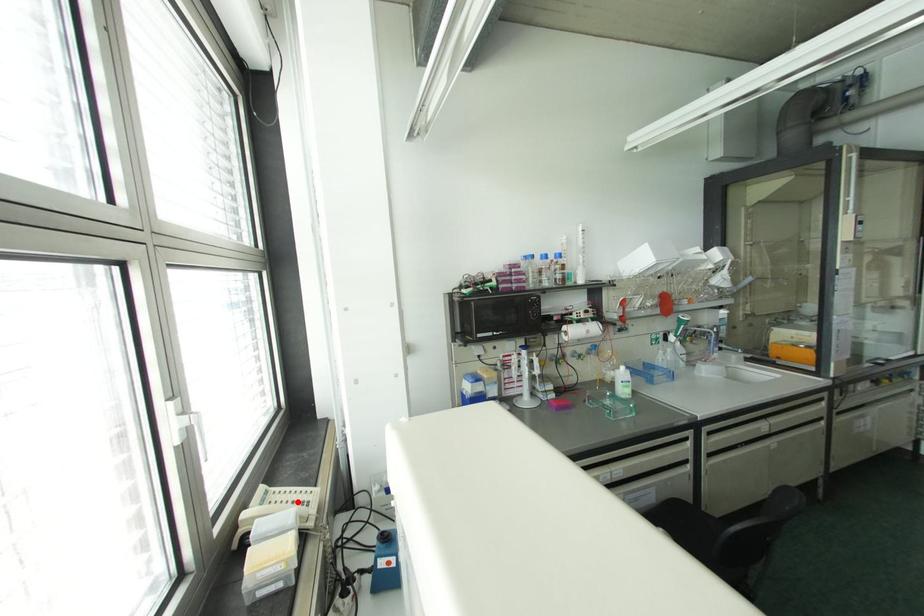
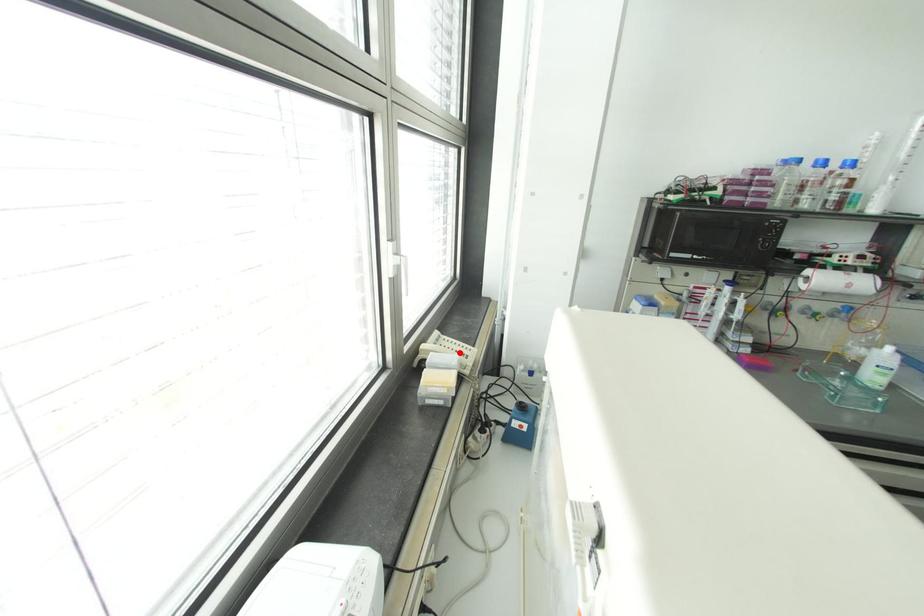
I am providing you with two images of the same scene from different viewpoints. A red point is marked on the first image and another point is marked on the second image. Are the points marked in image1 and image2 representing the same 3D position?

Yes